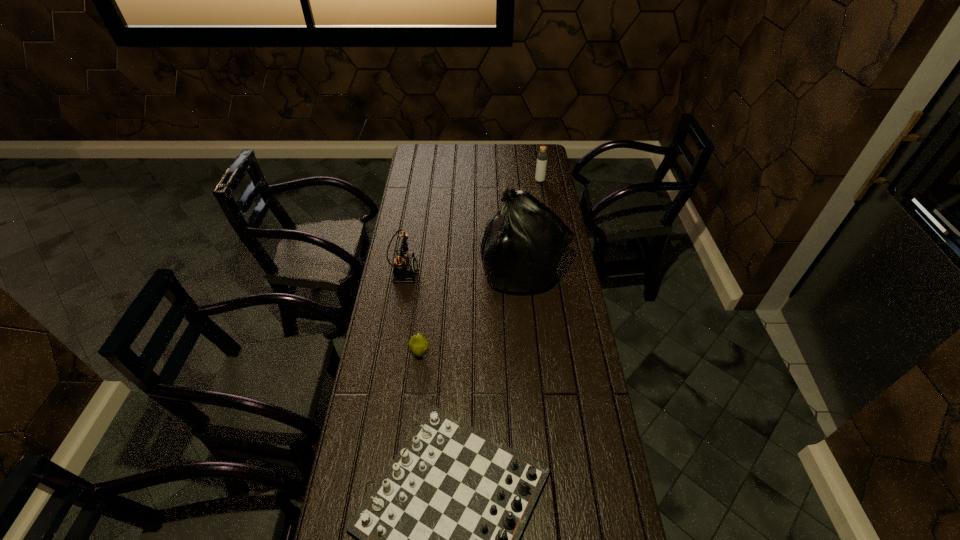
Identify the location of plastic bag situated at the right edge. (523, 241).

The image size is (960, 540). What are the coordinates of `bottle located in the right edge section of the desktop` in the screenshot? It's located at (542, 157).

Locate an element on the screen. blank space at the far edge is located at coordinates (483, 146).

At what (x,y) coordinates should I click in order to perform the action: click on vacant space at the left edge of the desktop. Please return your answer as a coordinate pair (x, y). The image size is (960, 540). Looking at the image, I should click on (416, 327).

Identify the location of vacant space at the right edge of the desktop. This screenshot has height=540, width=960. click(557, 434).

Locate an element on the screen. vacant space at the far right corner of the desktop is located at coordinates (525, 148).

Identify the location of vacant area between the bottle and the telephone. The image size is (960, 540). (471, 226).

Where is `unoccupied area between the bottle and the pear`? Image resolution: width=960 pixels, height=540 pixels. unoccupied area between the bottle and the pear is located at coordinates (480, 267).

The width and height of the screenshot is (960, 540). I want to click on vacant space that is in between the bottle and the pear, so click(480, 267).

Where is `free space that is in between the farthest object and the third shortest object`? free space that is in between the farthest object and the third shortest object is located at coordinates (471, 226).